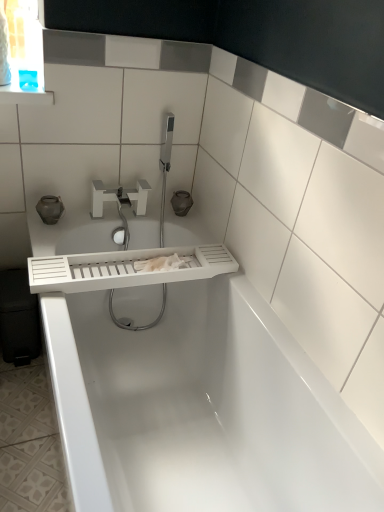
Question: Does white plastic tap at upper center come in front of white glossy bathtub at center?

Choices:
 (A) yes
 (B) no

Answer: (B)

Question: Does white plastic tap at upper center have a larger size compared to white glossy bathtub at center?

Choices:
 (A) yes
 (B) no

Answer: (B)

Question: Is white plastic tap at upper center placed right next to white glossy bathtub at center?

Choices:
 (A) no
 (B) yes

Answer: (A)

Question: From a real-world perspective, is white plastic tap at upper center under white glossy bathtub at center?

Choices:
 (A) yes
 (B) no

Answer: (B)

Question: Is white plastic tap at upper center facing towards white glossy bathtub at center?

Choices:
 (A) yes
 (B) no

Answer: (B)

Question: Can you confirm if white plastic tap at upper center is smaller than white glossy bathtub at center?

Choices:
 (A) no
 (B) yes

Answer: (B)

Question: From a real-world perspective, is white matte tray at center over white glossy bathtub at center?

Choices:
 (A) yes
 (B) no

Answer: (A)

Question: Is white matte tray at center bigger than white glossy bathtub at center?

Choices:
 (A) no
 (B) yes

Answer: (A)

Question: Considering the relative sizes of white matte tray at center and white glossy bathtub at center in the image provided, is white matte tray at center smaller than white glossy bathtub at center?

Choices:
 (A) no
 (B) yes

Answer: (B)

Question: From a real-world perspective, is white matte tray at center positioned under white glossy bathtub at center based on gravity?

Choices:
 (A) no
 (B) yes

Answer: (A)

Question: From the image's perspective, is white matte tray at center above white glossy bathtub at center?

Choices:
 (A) no
 (B) yes

Answer: (B)

Question: Is white matte tray at center placed right next to white glossy bathtub at center?

Choices:
 (A) yes
 (B) no

Answer: (B)

Question: Considering the relative sizes of white glossy bathtub at center and white plastic tap at upper center in the image provided, is white glossy bathtub at center wider than white plastic tap at upper center?

Choices:
 (A) no
 (B) yes

Answer: (B)